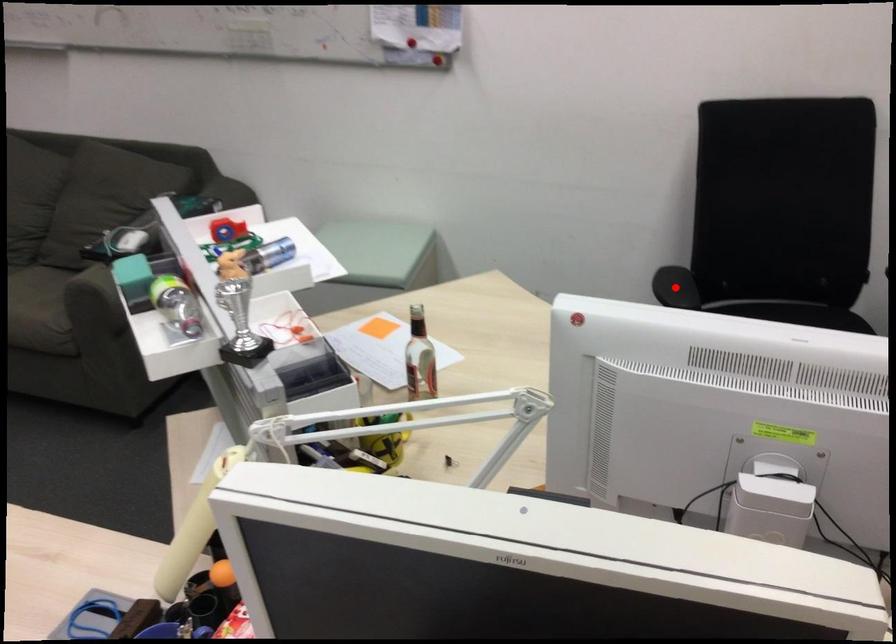
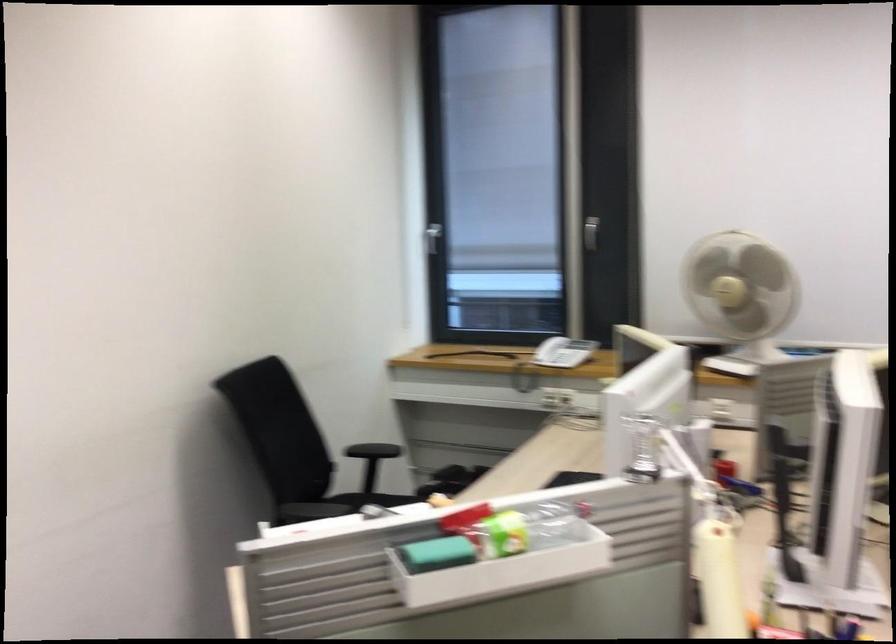
Question: I am providing you with two images of the same scene from different viewpoints. A red point is marked on the first image. Can you still see the location of the red point in image 2?

Choices:
 (A) Yes
 (B) No

Answer: (B)